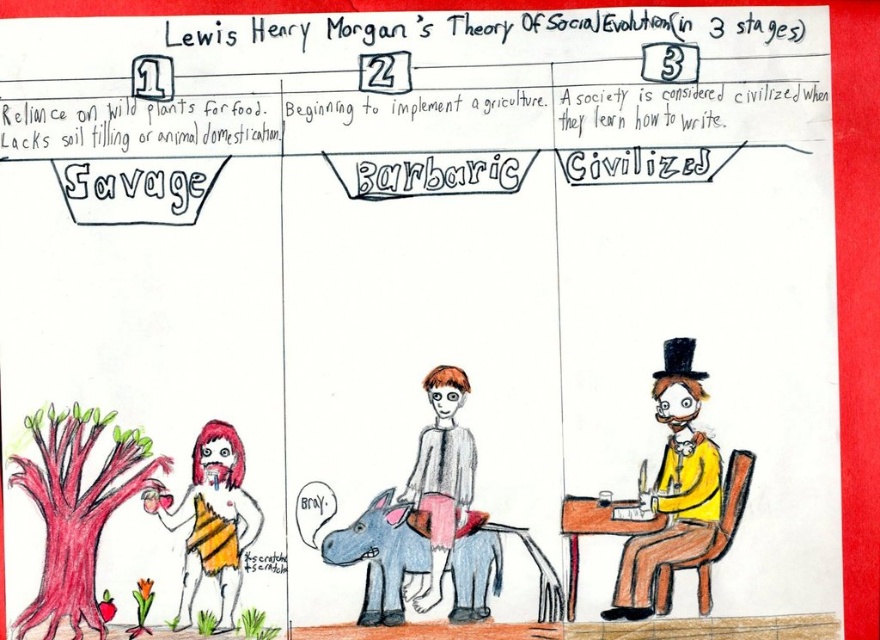
Does reddish-brown textured tree at lower left lie in front of yellow matte suit at center right?

Yes, it is in front of yellow matte suit at center right.

Does point (66, 600) come behind point (705, 547)?

No.

At what (x,y) coordinates should I click in order to perform the action: click on reddish-brown textured tree at lower left. Please return your answer as a coordinate pair (x, y). The width and height of the screenshot is (880, 640). Looking at the image, I should click on (76, 508).

Which is more to the right, reddish-brown textured tree at lower left or striped fabric figure at lower left?

Positioned to the right is striped fabric figure at lower left.

Is reddish-brown textured tree at lower left to the right of striped fabric figure at lower left from the viewer's perspective?

In fact, reddish-brown textured tree at lower left is to the left of striped fabric figure at lower left.

The image size is (880, 640). Describe the element at coordinates (76, 508) in the screenshot. I see `reddish-brown textured tree at lower left` at that location.

This screenshot has height=640, width=880. In order to click on reddish-brown textured tree at lower left in this screenshot , I will do `click(76, 508)`.

Between yellow matte suit at center right and light brown paper bag at center, which one is positioned lower?

light brown paper bag at center is lower down.

Which is more to the right, yellow matte suit at center right or light brown paper bag at center?

Positioned to the right is yellow matte suit at center right.

Is point (687, 480) closer to viewer compared to point (435, 394)?

No, (687, 480) is behind (435, 394).

Find the location of a particular element. yellow matte suit at center right is located at coordinates (672, 488).